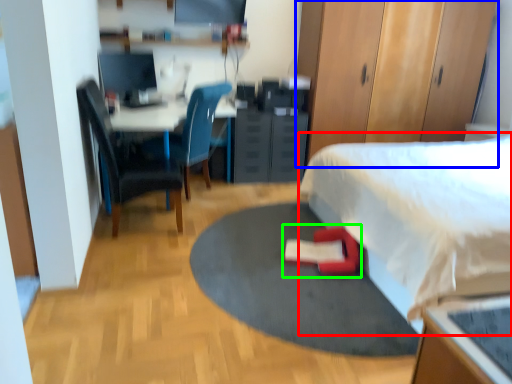
Question: Considering the real-world distances, which object is farthest from bed (highlighted by a red box)? dresser (highlighted by a blue box) or bean bag chair (highlighted by a green box)?

Choices:
 (A) dresser
 (B) bean bag chair

Answer: (A)